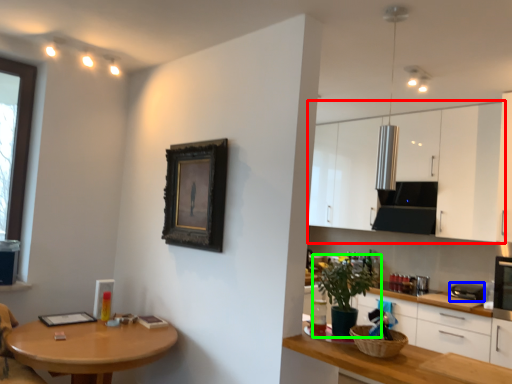
Question: Based on their relative distances, which object is farther from cabinetry (highlighted by a red box)? Choose from appliance (highlighted by a blue box) and houseplant (highlighted by a green box).

Choices:
 (A) appliance
 (B) houseplant

Answer: (B)